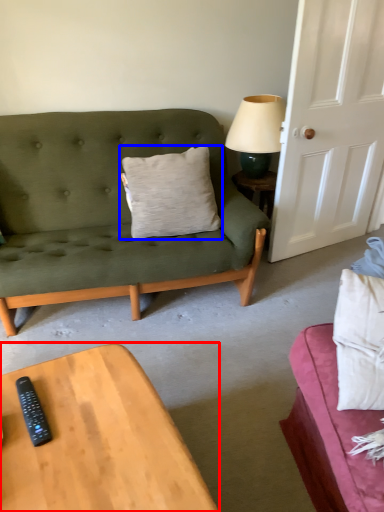
Question: Among these objects, which one is nearest to the camera, coffee table (highlighted by a red box) or pillow (highlighted by a blue box)?

Choices:
 (A) coffee table
 (B) pillow

Answer: (A)